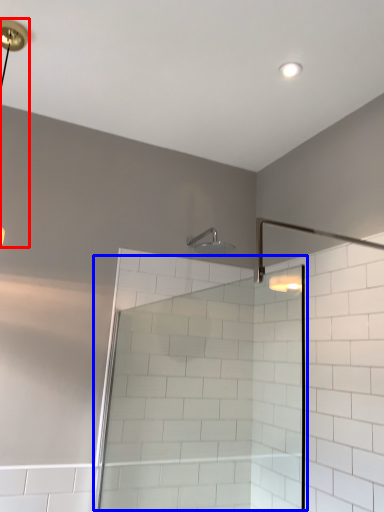
Question: Among these objects, which one is nearest to the camera, lamp (highlighted by a red box) or screen door (highlighted by a blue box)?

Choices:
 (A) lamp
 (B) screen door

Answer: (B)